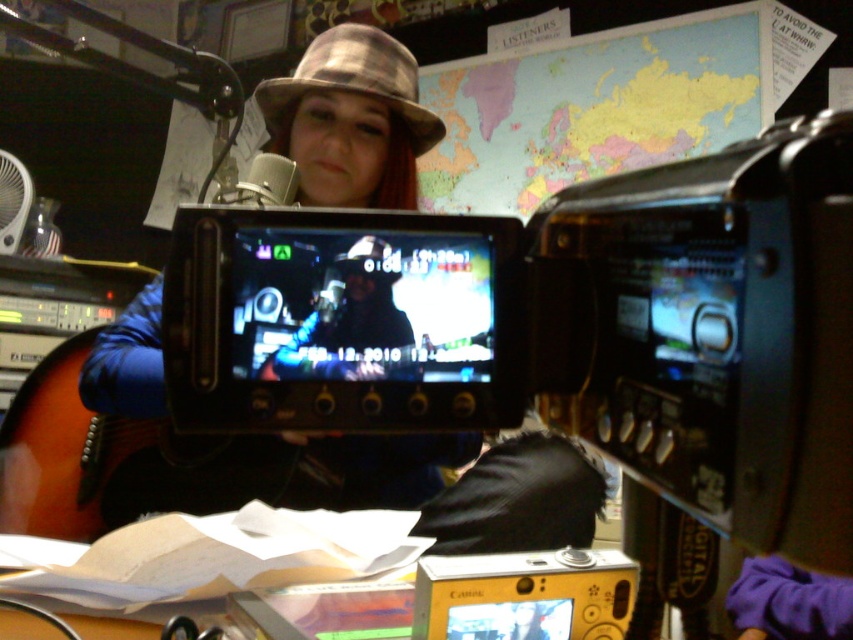
You are a technician in the studio and need to adjust two points in the scene. The points are labeled as point 1 at coordinate point (368, 323) and point 2 at coordinate point (259, 109). Which point should you adjust first if you want to start with the one closer to you?

Point 1 at coordinate point (368, 323) should be adjusted first because it is closer to the viewer than point 2 at coordinate point (259, 109).

You are a technician in the studio and need to place both the yellow plastic camera at lower center and the shiny metallic hat at center on a shelf that can only hold items up to the size of the smaller object. Which object should you choose?

The shiny metallic hat at center is smaller than the yellow plastic camera at lower center, so you should choose the shiny metallic hat at center to place on the shelf.

You are standing in a studio and want to reach the point marked at coordinates point (537,596). If your arm is 60 centimeters long, can you reach it without moving your feet?

The point (537,596) is 61.44 centimeters away from you, which is slightly longer than your arm span of 60 centimeters. Therefore, you cannot reach it without moving your feet.